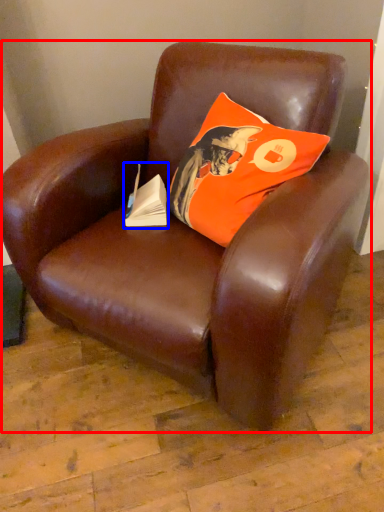
Question: Which point is closer to the camera, chair (highlighted by a red box) or paperback book (highlighted by a blue box)?

Choices:
 (A) chair
 (B) paperback book

Answer: (A)